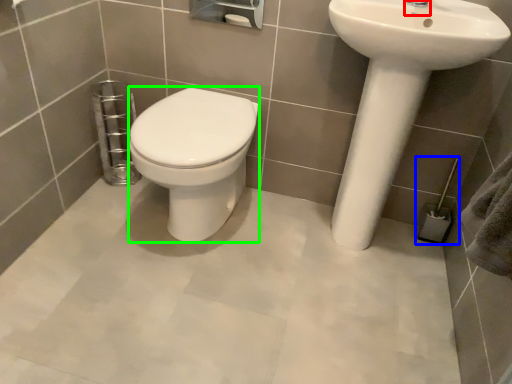
Question: Which is farther away from plumbing fixture (highlighted by a red box)? towel bar (highlighted by a blue box) or bidet (highlighted by a green box)?

Choices:
 (A) towel bar
 (B) bidet

Answer: (B)